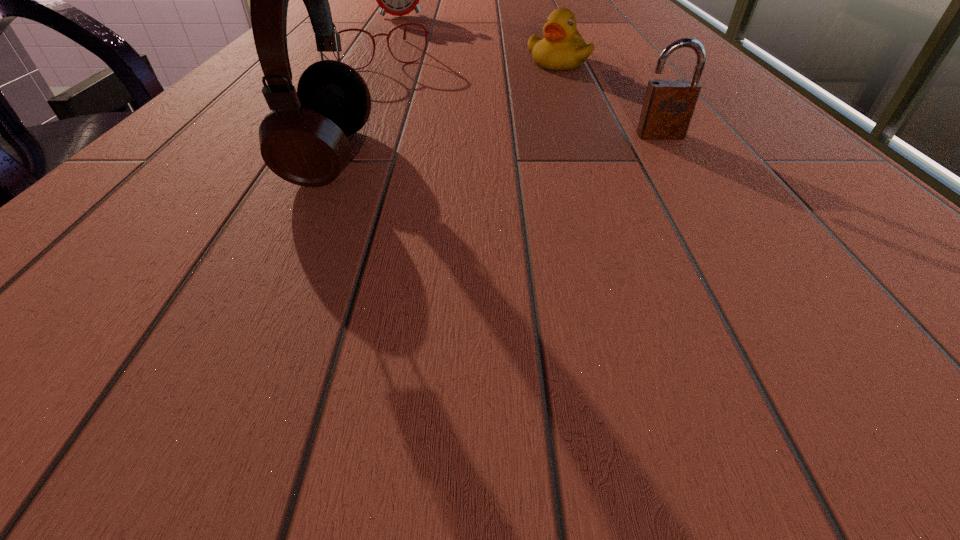
The height and width of the screenshot is (540, 960). Find the location of `vacant space on the desktop that is between the tallest object and the rightmost object and is positioned on the face of the spectacles`. vacant space on the desktop that is between the tallest object and the rightmost object and is positioned on the face of the spectacles is located at coordinates (456, 148).

Locate an element on the screen. The width and height of the screenshot is (960, 540). free spot on the desktop that is between the headset and the padlock and is positioned on the front-facing side of the farthest object is located at coordinates (530, 144).

Find the location of a particular element. vacant spot on the desktop that is between the headset and the rightmost object and is positioned at the face of the duckling is located at coordinates (533, 144).